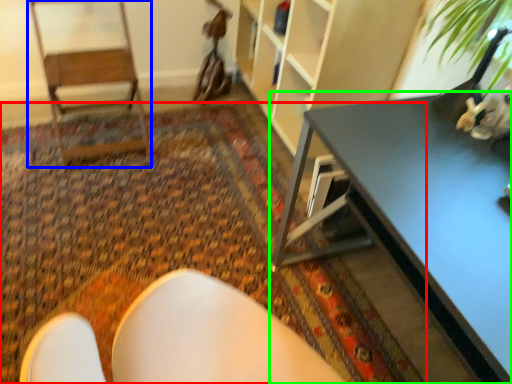
Question: Considering the real-world distances, which object is farthest from mat (highlighted by a red box)? armchair (highlighted by a blue box) or table (highlighted by a green box)?

Choices:
 (A) armchair
 (B) table

Answer: (B)